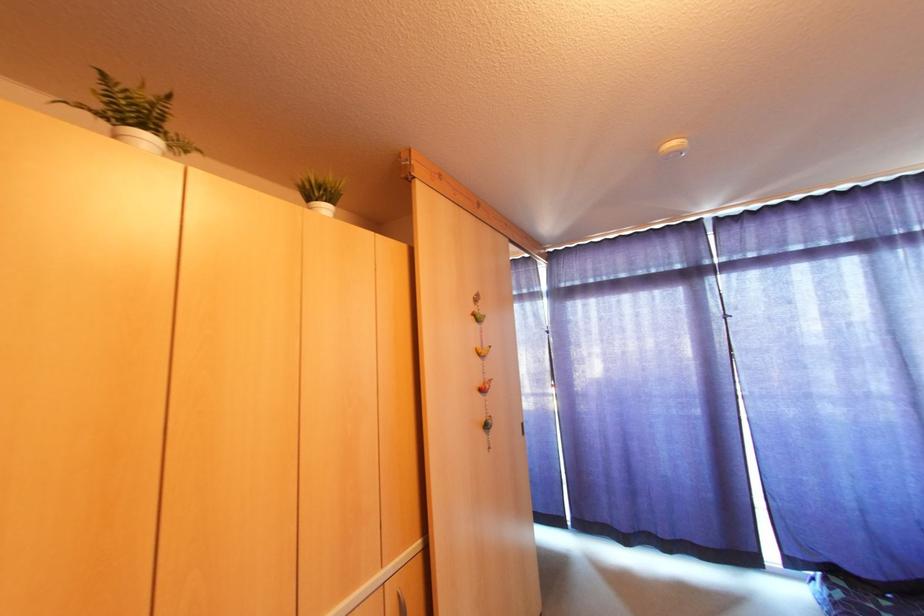
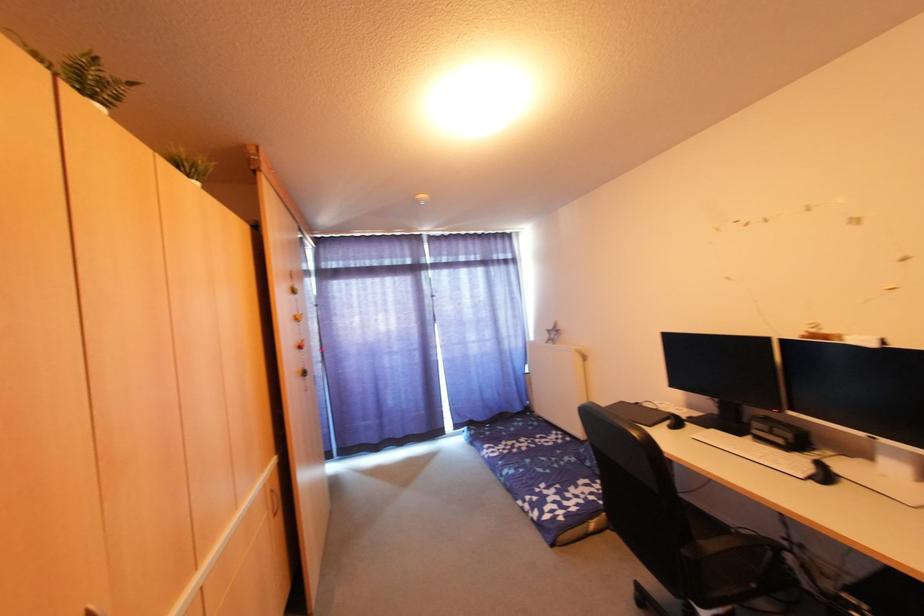
The point at (164,97) is marked in the first image. Where is the corresponding point in the second image?

(128, 84)